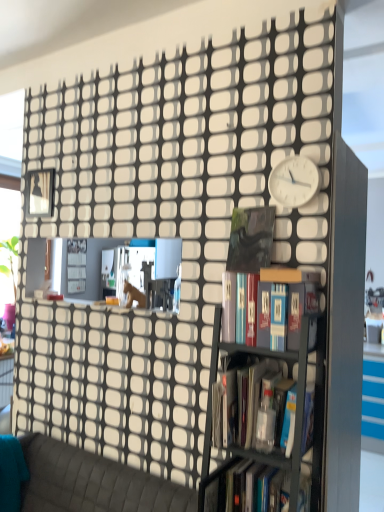
Where is `matte black book at upper center`? The height and width of the screenshot is (512, 384). matte black book at upper center is located at coordinates (250, 239).

What is the approximate height of matte black book at upper center?

It is 31.95 centimeters.

Describe the element at coordinates (40, 193) in the screenshot. The width and height of the screenshot is (384, 512). I see `matte black picture frame at upper left` at that location.

What is the approximate height of white plastic clock at upper right?

7.90 inches.

Measure the distance between white plastic clock at upper right and camera.

A distance of 1.59 meters exists between white plastic clock at upper right and camera.

In order to click on translucent plastic bottle at center, acting as the second book starting from the bottom in this screenshot , I will do `click(252, 405)`.

I want to click on metallic gray bookcase at center, so click(x=254, y=396).

This screenshot has width=384, height=512. Find the location of `hardcover books at center, the first book viewed from the top`. hardcover books at center, the first book viewed from the top is located at coordinates (285, 305).

Image resolution: width=384 pixels, height=512 pixels. Find the location of `textured gray couch at lower left`. textured gray couch at lower left is located at coordinates (92, 483).

Find the location of a particular element. The width and height of the screenshot is (384, 512). matte black book at upper center is located at coordinates (250, 239).

From a real-world perspective, who is located lower, hardcover books at center, the first book viewed from the top, or matte black book at upper center?

From a 3D spatial view, hardcover books at center, the first book viewed from the top, is below.

Is hardcover books at center, the first book viewed from the top, situated inside matte black book at upper center or outside?

hardcover books at center, the first book viewed from the top, is spatially situated outside matte black book at upper center.

Does hardcover books at center, the first book viewed from the top, lie in front of matte black book at upper center?

Yes, it is in front of matte black book at upper center.

Is hardcover books at center, the first book viewed from the top, directly adjacent to matte black book at upper center?

hardcover books at center, the first book viewed from the top, is not next to matte black book at upper center, and they're not touching.

Based on the photo, from a real-world perspective, does white plastic clock at upper right sit lower than textured gray couch at lower left?

No, from a real-world perspective, white plastic clock at upper right is not under textured gray couch at lower left.

Is white plastic clock at upper right aimed at textured gray couch at lower left?

No, white plastic clock at upper right is not oriented towards textured gray couch at lower left.

Between white plastic clock at upper right and textured gray couch at lower left, which one has more height?

textured gray couch at lower left.

Does hardcover book at center, which ranks as the 1th book in bottom-to-top order, have a greater height compared to matte black book at upper center?

In fact, hardcover book at center, which ranks as the 1th book in bottom-to-top order, may be shorter than matte black book at upper center.

Based on the photo, from the image's perspective, which is above, hardcover book at center, which is counted as the third book, starting from the top, or matte black book at upper center?

matte black book at upper center is shown above in the image.

Is the depth of hardcover book at center, which ranks as the 1th book in bottom-to-top order, less than that of matte black book at upper center?

Yes, it is.

Considering the relative positions of hardcover book at center, which ranks as the 1th book in bottom-to-top order, and matte black book at upper center in the image provided, is hardcover book at center, which ranks as the 1th book in bottom-to-top order, to the left of matte black book at upper center from the viewer's perspective?

Yes.

Looking at this image, is metallic gray bookcase at center behind textured gray couch at lower left?

No, the depth of metallic gray bookcase at center is less than that of textured gray couch at lower left.

What are the coordinates of `bookcase on the right of textured gray couch at lower left` in the screenshot? It's located at (254, 396).

In terms of width, does metallic gray bookcase at center look wider or thinner when compared to textured gray couch at lower left?

Clearly, metallic gray bookcase at center has less width compared to textured gray couch at lower left.

Who is shorter, hardcover book at center, which is counted as the third book, starting from the top, or textured gray couch at lower left?

hardcover book at center, which is counted as the third book, starting from the top, is shorter.

Looking at this image, is textured gray couch at lower left completely or partially inside hardcover book at center, which ranks as the 1th book in bottom-to-top order?

That's incorrect, textured gray couch at lower left is not inside hardcover book at center, which ranks as the 1th book in bottom-to-top order.

Is hardcover book at center, which is counted as the third book, starting from the top, far from textured gray couch at lower left?

Actually, hardcover book at center, which is counted as the third book, starting from the top, and textured gray couch at lower left are a little close together.

Considering the positions of objects hardcover book at center, which is counted as the third book, starting from the top, and textured gray couch at lower left in the image provided, who is more to the right, hardcover book at center, which is counted as the third book, starting from the top, or textured gray couch at lower left?

hardcover book at center, which is counted as the third book, starting from the top, is more to the right.

Is point (297, 189) closer to viewer compared to point (266, 234)?

Yes, it is.

Which of these two, white plastic clock at upper right or matte black book at upper center, is bigger?

white plastic clock at upper right.

Is white plastic clock at upper right taller than matte black book at upper center?

No, white plastic clock at upper right is not taller than matte black book at upper center.

From the image's perspective, which object appears higher, white plastic clock at upper right or matte black book at upper center?

white plastic clock at upper right, from the image's perspective.

Between point (250, 229) and point (100, 490), which one is positioned in front?

Positioned in front is point (250, 229).

Is textured gray couch at lower left at the back of matte black book at upper center?

No.

In order to click on studio couch that is in front of the matte black book at upper center in this screenshot , I will do `click(92, 483)`.

In terms of width, does matte black book at upper center look wider or thinner when compared to textured gray couch at lower left?

matte black book at upper center is thinner than textured gray couch at lower left.

Identify the location of paperback book above the hardcover books at center, the first book viewed from the top (from the image's perspective). (250, 239).

The image size is (384, 512). I want to click on studio couch below the white plastic clock at upper right (from a real-world perspective), so (x=92, y=483).

When comparing their distances from hardcover book at center, which ranks as the 1th book in bottom-to-top order, does matte black picture frame at upper left or white plastic clock at upper right seem further?

matte black picture frame at upper left is further to hardcover book at center, which ranks as the 1th book in bottom-to-top order.

When comparing their distances from textured gray couch at lower left, does translucent plastic bottle at center, which appears as the 2th book when viewed from the top, or matte black book at upper center seem further?

Among the two, matte black book at upper center is located further to textured gray couch at lower left.

Considering their positions, is metallic gray bookcase at center positioned closer to white plastic clock at upper right than matte black picture frame at upper left?

The object closer to white plastic clock at upper right is metallic gray bookcase at center.

Consider the image. Based on their spatial positions, is hardcover books at center, marked as the 3th book in a bottom-to-top arrangement, or metallic gray bookcase at center closer to hardcover book at center, which is counted as the third book, starting from the top?

metallic gray bookcase at center is closer to hardcover book at center, which is counted as the third book, starting from the top.

From the image, which object appears to be farther from matte black picture frame at upper left, hardcover books at center, marked as the 3th book in a bottom-to-top arrangement, or hardcover book at center, which ranks as the 1th book in bottom-to-top order?

hardcover book at center, which ranks as the 1th book in bottom-to-top order, is further to matte black picture frame at upper left.

From the image, which object appears to be nearer to hardcover book at center, which ranks as the 1th book in bottom-to-top order, hardcover books at center, marked as the 3th book in a bottom-to-top arrangement, or matte black picture frame at upper left?

hardcover books at center, marked as the 3th book in a bottom-to-top arrangement, is positioned closer to the anchor hardcover book at center, which ranks as the 1th book in bottom-to-top order.

Looking at the image, which one is located closer to metallic gray bookcase at center, white plastic clock at upper right or matte black picture frame at upper left?

white plastic clock at upper right lies closer to metallic gray bookcase at center than the other object.

When comparing their distances from textured gray couch at lower left, does translucent plastic bottle at center, which appears as the 2th book when viewed from the top, or white plastic clock at upper right seem further?

Among the two, white plastic clock at upper right is located further to textured gray couch at lower left.

In order to click on paperback book between white plastic clock at upper right and translucent plastic bottle at center, which appears as the 2th book when viewed from the top, vertically in this screenshot , I will do `click(250, 239)`.

Find the location of a particular element. paperback book between matte black picture frame at upper left and white plastic clock at upper right in the horizontal direction is located at coordinates [x=250, y=239].

Find the location of a particular element. This screenshot has height=512, width=384. bookcase between matte black picture frame at upper left and matte black book at upper center in the horizontal direction is located at coordinates (254, 396).

In order to click on bookcase between matte black book at upper center and hardcover book at center, which ranks as the 1th book in bottom-to-top order, in the vertical direction in this screenshot , I will do `click(254, 396)`.